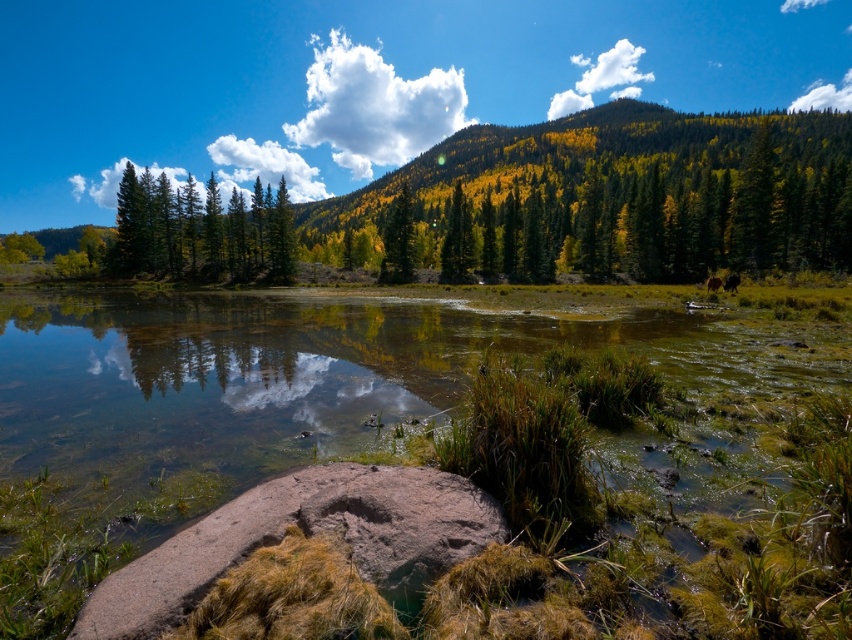
You are standing in the serene landscape and want to take a photo of the brown furry dog at lower right without the green matte trees at left blocking the view. Is this possible?

The green matte trees at left is positioned over brown furry dog at lower right, so the trees would block the view of the dog. Move to a position where you can see below the trees to capture the dog without obstruction.